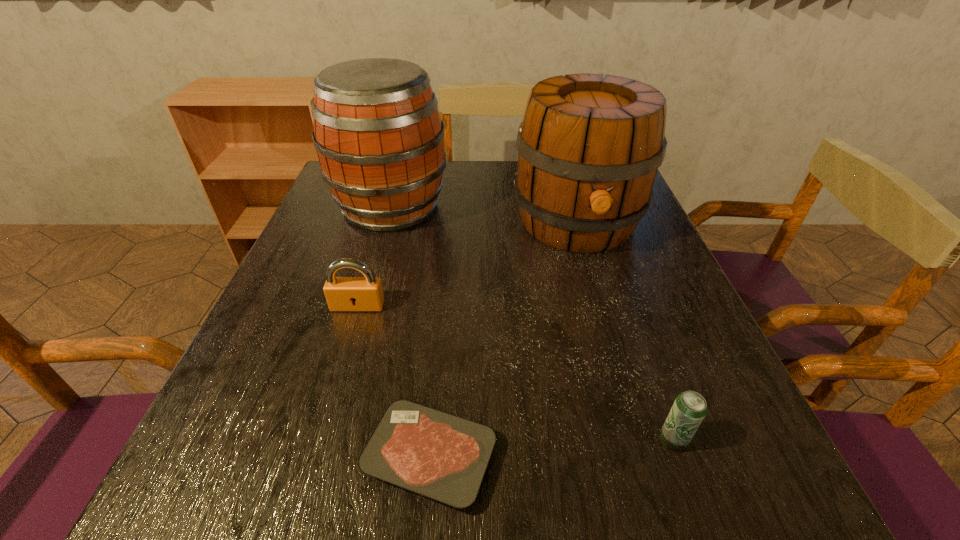
The width and height of the screenshot is (960, 540). I want to click on the left cider, so click(379, 137).

Locate an element on the screen. This screenshot has height=540, width=960. the right cider is located at coordinates pyautogui.click(x=589, y=148).

At what (x,y) coordinates should I click in order to perform the action: click on padlock. Please return your answer as a coordinate pair (x, y). Looking at the image, I should click on (365, 293).

The image size is (960, 540). What are the coordinates of `the third farthest object` in the screenshot? It's located at (365, 293).

Locate an element on the screen. the fourth tallest object is located at coordinates (689, 409).

I want to click on the shortest object, so click(x=439, y=455).

The height and width of the screenshot is (540, 960). Identify the location of vacant region located on the back of the left cider. (402, 166).

This screenshot has height=540, width=960. I want to click on vacant area situated 0.130m on the side of the right cider where the spigot is located, so tap(602, 309).

The height and width of the screenshot is (540, 960). I want to click on vacant space located to unlock the padlock from the front, so click(x=343, y=357).

You are a GUI agent. You are given a task and a screenshot of the screen. Output one action in this format:
    pyautogui.click(x=<x>, y=<y>)
    Task: Click on the vacant space situated 0.190m on the back of the beer can
    
    Given the screenshot: What is the action you would take?
    pyautogui.click(x=636, y=333)